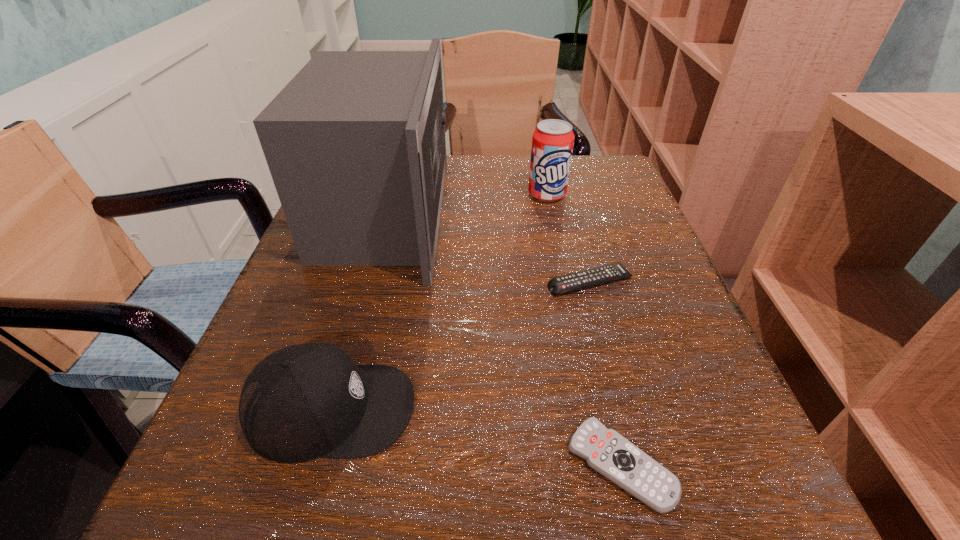
The width and height of the screenshot is (960, 540). Identify the location of object that is at the far right corner. (552, 142).

The image size is (960, 540). In order to click on object that is positioned at the near right corner in this screenshot , I will do `click(606, 451)`.

The height and width of the screenshot is (540, 960). Find the location of `vacant space at the far edge of the desktop`. vacant space at the far edge of the desktop is located at coordinates (476, 156).

Where is `vacant position at the near edge of the desktop`? This screenshot has width=960, height=540. vacant position at the near edge of the desktop is located at coordinates (451, 471).

Locate an element on the screen. The width and height of the screenshot is (960, 540). free space at the left edge of the desktop is located at coordinates (345, 267).

You are a GUI agent. You are given a task and a screenshot of the screen. Output one action in this format:
    pyautogui.click(x=<x>, y=<y>)
    Task: Click on the free location at the right edge of the desktop
    This screenshot has height=540, width=960.
    Given the screenshot: What is the action you would take?
    coord(711,388)

In the image, there is a desktop. At what (x,y) coordinates should I click in order to perform the action: click on free space at the far right corner. Please return your answer as a coordinate pair (x, y). This screenshot has height=540, width=960. Looking at the image, I should click on (589, 191).

Where is `vacant space in between the shorter remote control and the tallest object`? vacant space in between the shorter remote control and the tallest object is located at coordinates [x=503, y=339].

Where is `unoccupied position between the farther remote control and the soda can`? This screenshot has width=960, height=540. unoccupied position between the farther remote control and the soda can is located at coordinates (568, 239).

In order to click on free space that is in between the farther remote control and the tallest object in this screenshot , I will do `click(488, 248)`.